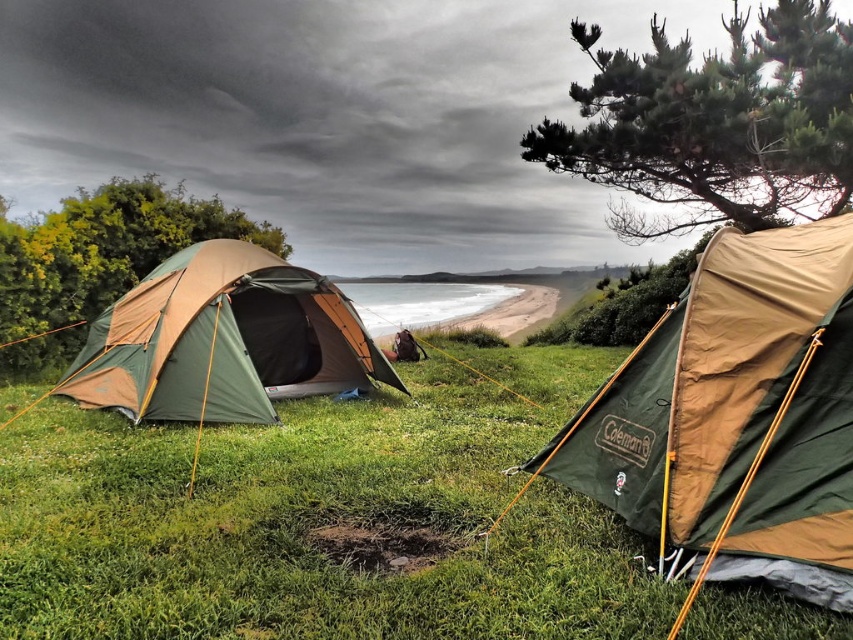
Question: Which is farther from the green textured tree at upper right?

Choices:
 (A) green grassy at center
 (B) green fabric tent at left
 (C) green matte tent at left

Answer: (A)

Question: Where is green textured tree at upper right located in relation to green matte tent at left in the image?

Choices:
 (A) right
 (B) left

Answer: (A)

Question: Can you confirm if green fabric tent at center is wider than green textured tree at upper right?

Choices:
 (A) no
 (B) yes

Answer: (A)

Question: Among these objects, which one is nearest to the camera?

Choices:
 (A) green textured tree at upper right
 (B) green fabric tent at center
 (C) green grassy at center

Answer: (B)

Question: Does green fabric tent at center appear on the left side of green textured tree at upper right?

Choices:
 (A) yes
 (B) no

Answer: (A)

Question: Which point is farther to the camera?

Choices:
 (A) (811, 166)
 (B) (332, 552)
 (C) (743, 467)
 (D) (155, 342)

Answer: (A)